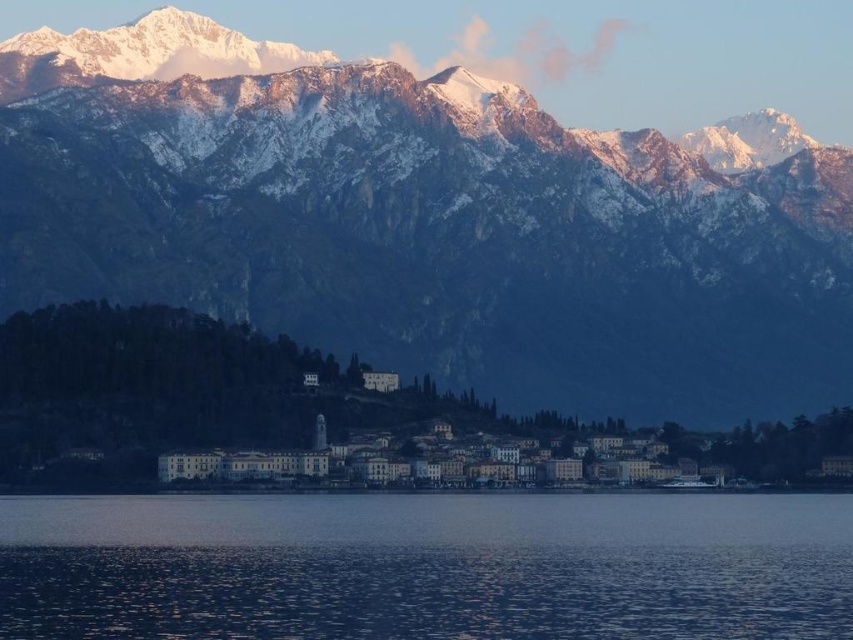
You are an observer looking at the town from the water. Which object is positioned to the left of the other between the snowy rock mountain range at upper center and the blue water at lower center?

The snowy rock mountain range at upper center is to the left of the blue water at lower center.

In the scene shown: You are a photographer planning to capture the snowy rock mountain range at upper center and the blue water at lower center in a single shot. Given that your camera can focus on objects up to 60 meters apart, will you be able to capture both in focus?

The snowy rock mountain range at upper center is 66.34 meters from the blue water at lower center. Since the distance exceeds the camera focus limit of 60 meters, you might need to adjust your position or use a different camera setting to ensure both are in focus.

You are standing at the edge of the calm body of water in the foreground of the image. You want to take a photo of the snowy rock mountain range at upper center without any obstructions. Is the mountain range far enough away that you can capture it fully in your photo?

The snowy rock mountain range at upper center is 647.00 meters away from camera, so yes, the mountain range is far enough away to be captured fully in your photo without obstructions.